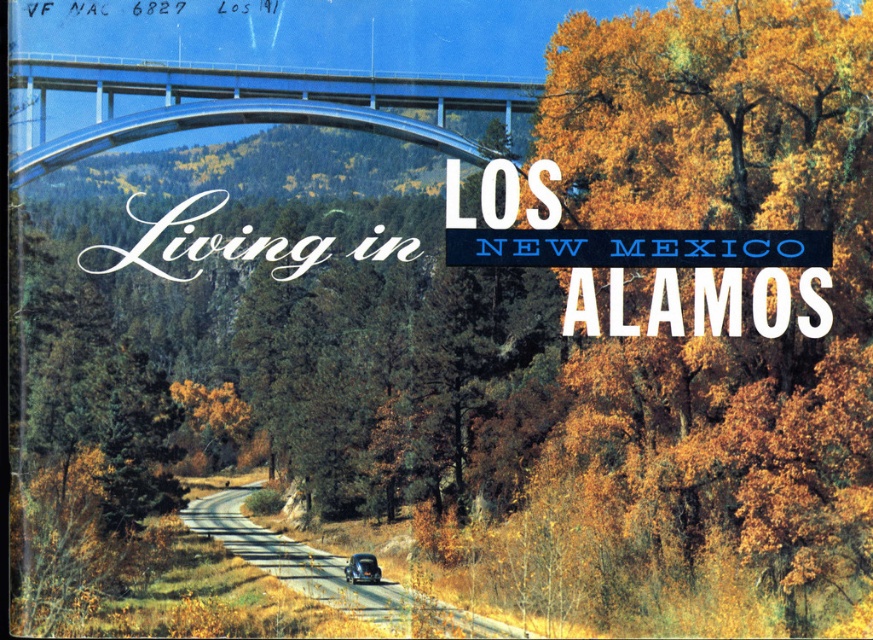
Question: From the image, what is the correct spatial relationship of metallic silver bridge at upper center in relation to shiny black car at center?

Choices:
 (A) above
 (B) below

Answer: (A)

Question: Which object appears farthest from the camera in this image?

Choices:
 (A) metallic silver bridge at upper center
 (B) smooth asphalt road at center

Answer: (B)

Question: Which point appears closest to the camera in this image?

Choices:
 (A) (478, 150)
 (B) (356, 596)

Answer: (B)

Question: Is metallic silver bridge at upper center smaller than smooth asphalt road at center?

Choices:
 (A) yes
 (B) no

Answer: (B)

Question: Does smooth asphalt road at center come in front of shiny black car at center?

Choices:
 (A) no
 (B) yes

Answer: (B)

Question: Estimate the real-world distances between objects in this image. Which object is closer to the metallic silver bridge at upper center?

Choices:
 (A) shiny black car at center
 (B) smooth asphalt road at center

Answer: (B)